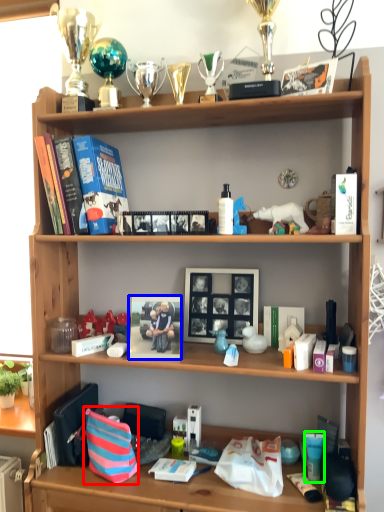
Question: Considering the real-world distances, which object is closest to shopping bag (highlighted by a red box)? book cover (highlighted by a blue box) or toiletry (highlighted by a green box).

Choices:
 (A) book cover
 (B) toiletry

Answer: (A)